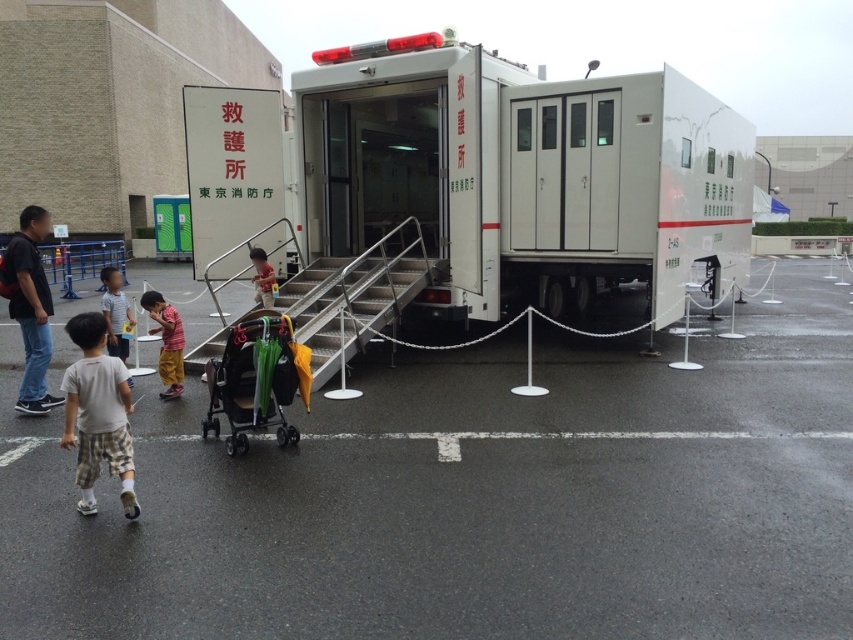
You are a photographer standing at a certain distance from the white matte truck at center. You want to take a photo of it without any foreground objects blocking the view. Given that you can only move forward or backward, what is the minimum distance you should be from the truck to ensure no obstructions?

The white matte truck at center is 8.43 meters away from the camera. To avoid foreground obstructions, you should position yourself at least 8.43 meters away from the truck.

You are a parent trying to retrieve your baby from the green plastic baby carriage at center. The metallic silver stairs at center might be in your way. Which direction should you move to avoid the stairs?

The metallic silver stairs at center is to the right of the green plastic baby carriage at center, so you should move to the left to avoid the stairs.